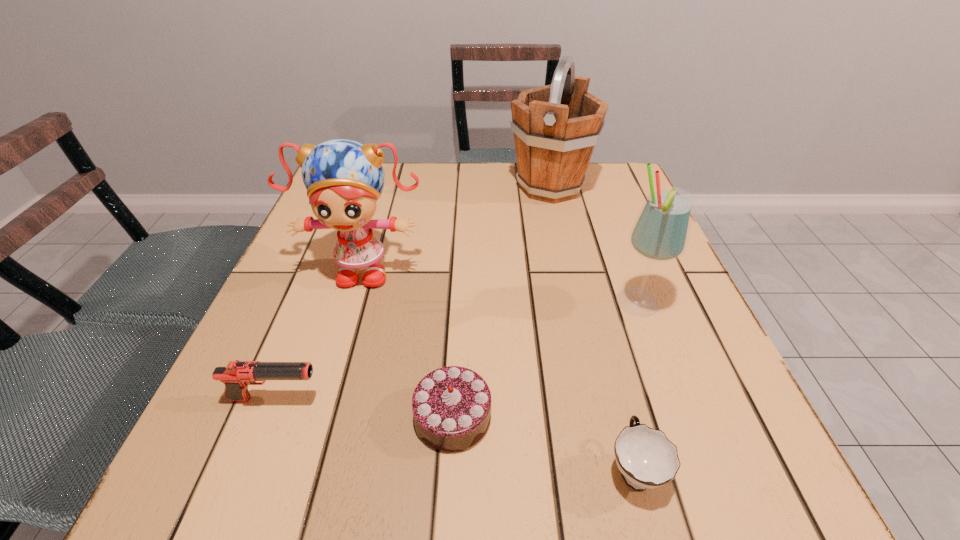
The image size is (960, 540). Find the location of `free space located 0.110m on the right of the chocolate cake`. free space located 0.110m on the right of the chocolate cake is located at coordinates (563, 416).

Locate an element on the screen. Image resolution: width=960 pixels, height=540 pixels. free spot located 0.280m on the side of the cup with the handle is located at coordinates (590, 301).

Identify the location of vacant area located on the side of the cup with the handle. (591, 305).

Where is `free space located on the side of the cup with the handle`? This screenshot has height=540, width=960. free space located on the side of the cup with the handle is located at coordinates (604, 354).

This screenshot has height=540, width=960. I want to click on object present at the far edge, so click(556, 127).

This screenshot has width=960, height=540. Identify the location of chocolate cake that is at the near edge. (451, 406).

Image resolution: width=960 pixels, height=540 pixels. I want to click on cup located in the near edge section of the desktop, so click(646, 458).

Find the location of a particular element. The width and height of the screenshot is (960, 540). doll that is at the left edge is located at coordinates (344, 179).

Image resolution: width=960 pixels, height=540 pixels. In order to click on gun that is positioned at the left edge in this screenshot , I will do `click(237, 375)`.

You are a GUI agent. You are given a task and a screenshot of the screen. Output one action in this format:
    pyautogui.click(x=<x>, y=<y>)
    Task: Click on the bucket located at the right edge
    This screenshot has width=960, height=540.
    Given the screenshot: What is the action you would take?
    pyautogui.click(x=556, y=127)